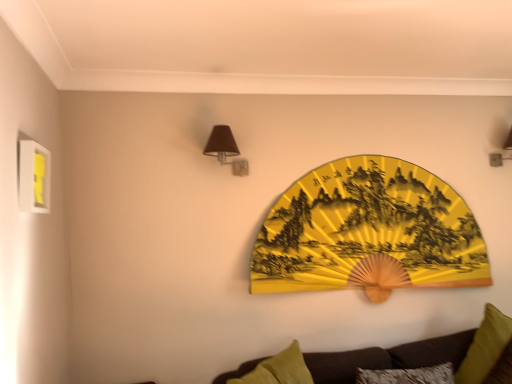
The height and width of the screenshot is (384, 512). Describe the element at coordinates (34, 177) in the screenshot. I see `yellow matte picture frame at upper left` at that location.

The width and height of the screenshot is (512, 384). Describe the element at coordinates (415, 354) in the screenshot. I see `dark brown fabric couch at lower right` at that location.

At what (x,y) coordinates should I click in order to perform the action: click on green fabric pillow at lower right. Please return your answer as a coordinate pair (x, y). The width and height of the screenshot is (512, 384). Looking at the image, I should click on (485, 346).

Describe the element at coordinates (485, 346) in the screenshot. I see `green fabric pillow at lower right` at that location.

Describe the element at coordinates (497, 159) in the screenshot. I see `matte brown wall sconce at upper right, marked as the second lamp in a front-to-back arrangement` at that location.

Find the location of a particular element. This screenshot has width=512, height=384. matte brown lampshade at upper left, which is the 2th lamp from back to front is located at coordinates (225, 149).

Does matte brown lampshade at upper left, which is counted as the 1th lamp, starting from the front, touch dark brown fabric couch at lower right?

No, matte brown lampshade at upper left, which is counted as the 1th lamp, starting from the front, is not making contact with dark brown fabric couch at lower right.

From a real-world perspective, is matte brown lampshade at upper left, which is counted as the 1th lamp, starting from the front, under dark brown fabric couch at lower right?

Actually, matte brown lampshade at upper left, which is counted as the 1th lamp, starting from the front, is physically above dark brown fabric couch at lower right in the real world.

Considering the sizes of objects matte brown lampshade at upper left, the 1th lamp in the left-to-right sequence, and dark brown fabric couch at lower right in the image provided, who is wider, matte brown lampshade at upper left, the 1th lamp in the left-to-right sequence, or dark brown fabric couch at lower right?

dark brown fabric couch at lower right is wider.

Can matte brown lampshade at upper left, which is the 2th lamp from back to front, be found inside yellow matte picture frame at upper left?

No, matte brown lampshade at upper left, which is the 2th lamp from back to front, is located outside of yellow matte picture frame at upper left.

Is yellow matte picture frame at upper left looking in the opposite direction of matte brown lampshade at upper left, the 1th lamp in the left-to-right sequence?

No, yellow matte picture frame at upper left is not facing away from matte brown lampshade at upper left, the 1th lamp in the left-to-right sequence.

From a real-world perspective, is yellow matte picture frame at upper left located higher than matte brown lampshade at upper left, the 1th lamp in the left-to-right sequence?

No, from a real-world perspective, yellow matte picture frame at upper left is not on top of matte brown lampshade at upper left, the 1th lamp in the left-to-right sequence.

Can you confirm if yellow matte picture frame at upper left is smaller than matte brown lampshade at upper left, the 1th lamp in the left-to-right sequence?

Indeed, yellow matte picture frame at upper left has a smaller size compared to matte brown lampshade at upper left, the 1th lamp in the left-to-right sequence.

Can you confirm if matte brown lampshade at upper left, the 1th lamp in the left-to-right sequence, is bigger than yellow matte picture frame at upper left?

Yes.

Considering the points (226, 141) and (29, 171), which point is in front, point (226, 141) or point (29, 171)?

Positioned in front is point (29, 171).

Is yellow matte picture frame at upper left completely or partially inside matte brown lampshade at upper left, positioned as the 2th lamp in right-to-left order?

Definitely not — yellow matte picture frame at upper left is not inside matte brown lampshade at upper left, positioned as the 2th lamp in right-to-left order.

Are matte brown lampshade at upper left, which is counted as the 1th lamp, starting from the front, and yellow matte picture frame at upper left beside each other?

No.

Is dark brown fabric couch at lower right in front of matte brown wall sconce at upper right, which is the first lamp in back-to-front order?

Yes, dark brown fabric couch at lower right is in front of matte brown wall sconce at upper right, which is the first lamp in back-to-front order.

Can you confirm if dark brown fabric couch at lower right is positioned to the left of matte brown wall sconce at upper right, marked as the second lamp in a front-to-back arrangement?

Yes, dark brown fabric couch at lower right is to the left of matte brown wall sconce at upper right, marked as the second lamp in a front-to-back arrangement.

Looking at this image, is dark brown fabric couch at lower right to the left or to the right of yellow matte picture frame at upper left in the image?

In the image, dark brown fabric couch at lower right appears on the right side of yellow matte picture frame at upper left.

Between dark brown fabric couch at lower right and yellow matte picture frame at upper left, which one is positioned behind?

yellow matte picture frame at upper left is further away from the camera.

Is dark brown fabric couch at lower right wider than yellow matte picture frame at upper left?

Correct, the width of dark brown fabric couch at lower right exceeds that of yellow matte picture frame at upper left.

Is dark brown fabric couch at lower right taller than yellow matte picture frame at upper left?

Yes.

Does point (267, 271) appear closer or farther from the camera than point (340, 362)?

Clearly, point (267, 271) is more distant from the camera than point (340, 362).

Which object is closer to the camera taking this photo, yellow paper fan at center or dark brown fabric couch at lower right?

Positioned in front is dark brown fabric couch at lower right.

Is the surface of yellow paper fan at center in direct contact with dark brown fabric couch at lower right?

No, yellow paper fan at center is not with dark brown fabric couch at lower right.

Considering the relative sizes of yellow paper fan at center and dark brown fabric couch at lower right in the image provided, is yellow paper fan at center bigger than dark brown fabric couch at lower right?

No, yellow paper fan at center is not bigger than dark brown fabric couch at lower right.

Considering the sizes of yellow matte picture frame at upper left and green fabric pillow at lower right in the image, is yellow matte picture frame at upper left wider or thinner than green fabric pillow at lower right?

In the image, yellow matte picture frame at upper left appears to be more narrow than green fabric pillow at lower right.

Consider the image. Which object is closer to the camera taking this photo, yellow matte picture frame at upper left or green fabric pillow at lower right?

yellow matte picture frame at upper left is more forward.

Which is more to the right, yellow matte picture frame at upper left or green fabric pillow at lower right?

green fabric pillow at lower right is more to the right.

Considering the sizes of yellow matte picture frame at upper left and green fabric pillow at lower right in the image, is yellow matte picture frame at upper left bigger or smaller than green fabric pillow at lower right?

In the image, yellow matte picture frame at upper left appears to be smaller than green fabric pillow at lower right.

From a real-world perspective, starting from the dark brown fabric couch at lower right, which lamp is the 2nd one vertically above it? Please provide its 2D coordinates.

[(225, 149)]

In order to click on picture frame beneath the matte brown lampshade at upper left, which is counted as the 1th lamp, starting from the front (from a real-world perspective) in this screenshot , I will do `click(34, 177)`.

Which object lies further to the anchor point matte brown wall sconce at upper right, which is the first lamp in back-to-front order, green fabric pillow at lower right or matte brown lampshade at upper left, which is counted as the 1th lamp, starting from the front?

matte brown lampshade at upper left, which is counted as the 1th lamp, starting from the front, lies further to matte brown wall sconce at upper right, which is the first lamp in back-to-front order, than the other object.

Based on their spatial positions, is green fabric pillow at lower right or yellow paper fan at center closer to matte brown wall sconce at upper right, the 1th lamp in the right-to-left sequence?

Among the two, yellow paper fan at center is located nearer to matte brown wall sconce at upper right, the 1th lamp in the right-to-left sequence.

Based on the photo, from the image, which object appears to be farther from yellow matte picture frame at upper left, yellow paper fan at center or matte brown wall sconce at upper right, which is the 2th lamp in left-to-right order?

Among the two, matte brown wall sconce at upper right, which is the 2th lamp in left-to-right order, is located further to yellow matte picture frame at upper left.

Looking at the image, which one is located closer to yellow paper fan at center, green fabric pillow at lower right or matte brown lampshade at upper left, which is counted as the 1th lamp, starting from the front?

The object closer to yellow paper fan at center is green fabric pillow at lower right.

Based on their spatial positions, is matte brown lampshade at upper left, positioned as the 2th lamp in right-to-left order, or dark brown fabric couch at lower right further from matte brown wall sconce at upper right, which is the first lamp in back-to-front order?

Based on the image, matte brown lampshade at upper left, positioned as the 2th lamp in right-to-left order, appears to be further to matte brown wall sconce at upper right, which is the first lamp in back-to-front order.

When comparing their distances from matte brown wall sconce at upper right, which is the 2th lamp in left-to-right order, does yellow matte picture frame at upper left or yellow paper fan at center seem further?

yellow matte picture frame at upper left is positioned further to the anchor matte brown wall sconce at upper right, which is the 2th lamp in left-to-right order.

In the scene shown: From the image, which object appears to be nearer to yellow paper fan at center, dark brown fabric couch at lower right or yellow matte picture frame at upper left?

dark brown fabric couch at lower right is positioned closer to the anchor yellow paper fan at center.

Considering their positions, is yellow paper fan at center positioned further to matte brown wall sconce at upper right, the 1th lamp in the right-to-left sequence, than dark brown fabric couch at lower right?

dark brown fabric couch at lower right.

Locate an element on the screen. This screenshot has width=512, height=384. studio couch located between matte brown lampshade at upper left, which is counted as the 1th lamp, starting from the front, and green fabric pillow at lower right in the left-right direction is located at coordinates (415, 354).

Where is `pillow between dark brown fabric couch at lower right and yellow paper fan at center in the front-back direction`? The image size is (512, 384). pillow between dark brown fabric couch at lower right and yellow paper fan at center in the front-back direction is located at coordinates (485, 346).

The width and height of the screenshot is (512, 384). I want to click on studio couch between yellow matte picture frame at upper left and matte brown wall sconce at upper right, which is the first lamp in back-to-front order, from left to right, so click(415, 354).

Locate an element on the screen. The width and height of the screenshot is (512, 384). lamp between yellow matte picture frame at upper left and matte brown wall sconce at upper right, marked as the second lamp in a front-to-back arrangement, from left to right is located at coordinates (225, 149).